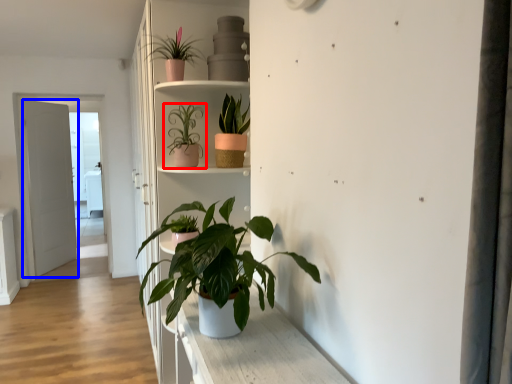
Question: Which point is further to the camera, houseplant (highlighted by a red box) or door (highlighted by a blue box)?

Choices:
 (A) houseplant
 (B) door

Answer: (B)